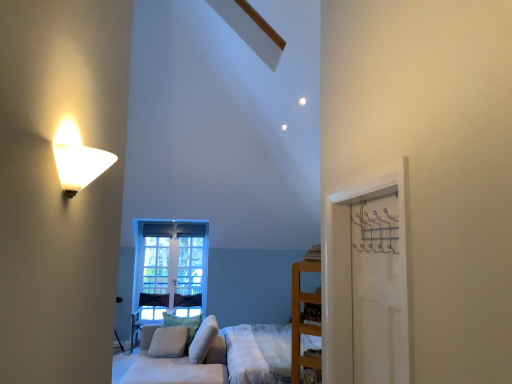
Question: Choose the correct answer: Is metallic silver hanger at right inside white matte door at right or outside it?

Choices:
 (A) inside
 (B) outside

Answer: (B)

Question: Considering the positions of point [x=385, y=233] and point [x=387, y=258], is point [x=385, y=233] closer or farther from the camera than point [x=387, y=258]?

Choices:
 (A) farther
 (B) closer

Answer: (A)

Question: Considering the real-world distances, which object is closest to the clear glass window at center?

Choices:
 (A) white matte lampshade at upper left
 (B) white soft pillow at center, marked as the 1th pillow in a right-to-left arrangement
 (C) metallic silver hanger at right
 (D) white matte door at right
 (E) wooden shelf at right

Answer: (B)

Question: Which of these objects is positioned farthest from the white matte door at right?

Choices:
 (A) white matte lampshade at upper left
 (B) metallic silver hanger at right
 (C) wooden bed frame at lower center
 (D) white soft pillow at center, which is counted as the first pillow, starting from the left
 (E) clear glass window at center

Answer: (E)